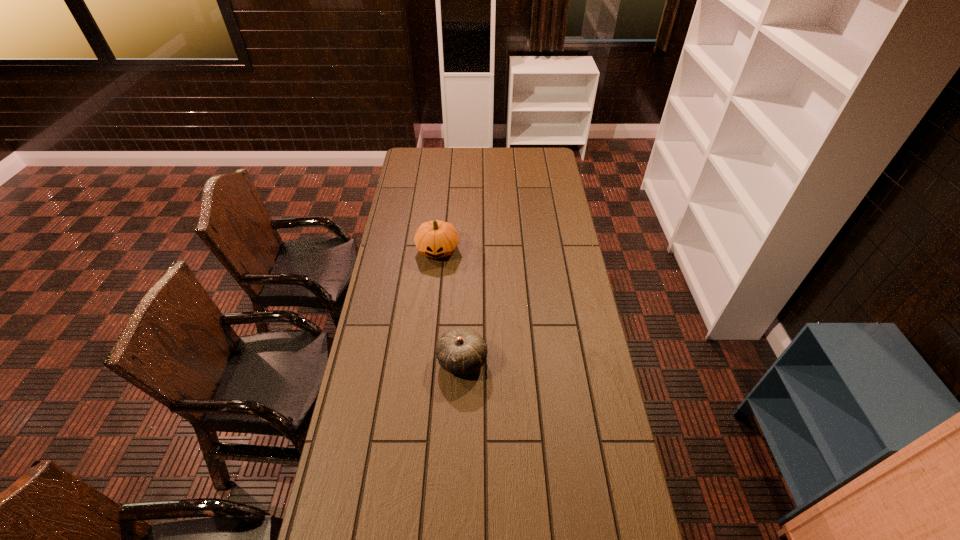
Image resolution: width=960 pixels, height=540 pixels. I want to click on vacant space in between the taller gourd and the shorter object, so click(450, 305).

You are a GUI agent. You are given a task and a screenshot of the screen. Output one action in this format:
    pyautogui.click(x=<x>, y=<y>)
    Task: Click on the blank region between the farther object and the shorter object
    
    Given the screenshot: What is the action you would take?
    pyautogui.click(x=450, y=305)

You are a GUI agent. You are given a task and a screenshot of the screen. Output one action in this format:
    pyautogui.click(x=<x>, y=<y>)
    Task: Click on the free area in between the taller object and the shorter gourd
    The image size is (960, 540).
    Given the screenshot: What is the action you would take?
    pyautogui.click(x=450, y=305)

Image resolution: width=960 pixels, height=540 pixels. I want to click on free location that satisfies the following two spatial constraints: 1. on the side of the farther gourd with the carved face; 2. on the left side of the nearer gourd, so click(x=426, y=360).